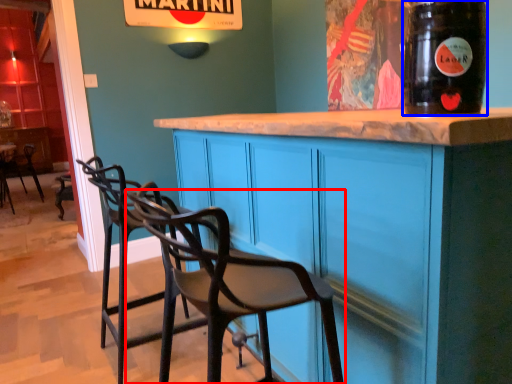
Question: Among these objects, which one is farthest to the camera, chair (highlighted by a red box) or drinking straw (highlighted by a blue box)?

Choices:
 (A) chair
 (B) drinking straw

Answer: (B)